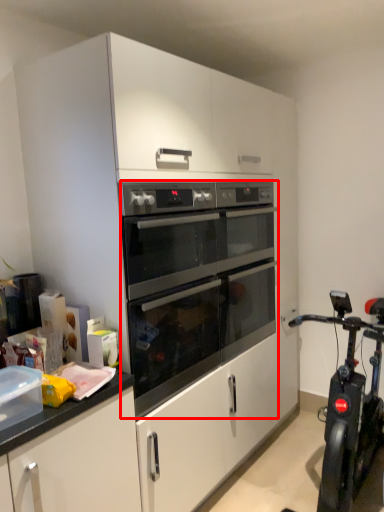
Question: From the image's perspective, where is oven (annotated by the red box) located in relation to stationary bicycle in the image?

Choices:
 (A) below
 (B) above

Answer: (B)